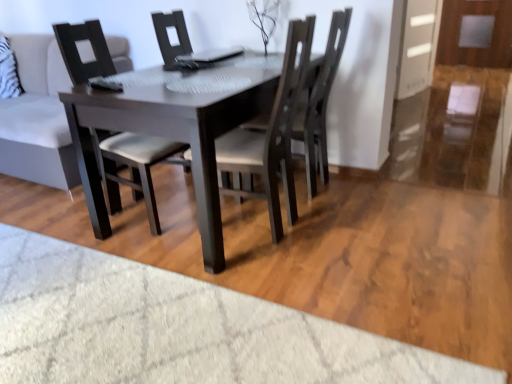
Image resolution: width=512 pixels, height=384 pixels. I want to click on free space in front of dark wood chair at center, which is counted as the second chair, starting from the left, so click(x=262, y=283).